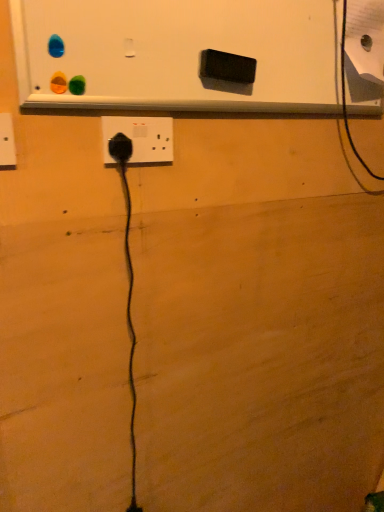
What do you see at coordinates (176, 54) in the screenshot? The height and width of the screenshot is (512, 384). I see `white matte bulletin board at upper center` at bounding box center [176, 54].

What do you see at coordinates (120, 148) in the screenshot? I see `black rubber power plug at center, the 3th power plugs and sockets positioned from the front` at bounding box center [120, 148].

The width and height of the screenshot is (384, 512). I want to click on white matte bulletin board at upper center, so click(176, 54).

Which is behind, point (168, 122) or point (8, 135)?

Point (168, 122)

The image size is (384, 512). What are the coordinates of `power plugs and sockets that appears in front of the black plastic power plug at center, the third power plugs and sockets from the left` in the screenshot? It's located at (x=7, y=143).

Considering the relative sizes of black plastic power plug at center, which is the 2th power plugs and sockets in front-to-back order, and black plastic power plug at left, the third power plugs and sockets from the right, in the image provided, is black plastic power plug at center, which is the 2th power plugs and sockets in front-to-back order, thinner than black plastic power plug at left, the third power plugs and sockets from the right,?

Yes, black plastic power plug at center, which is the 2th power plugs and sockets in front-to-back order, is thinner than black plastic power plug at left, the third power plugs and sockets from the right.

From the image's perspective, would you say black plastic power plug at center, which is the 2th power plugs and sockets in front-to-back order, is shown under black plastic power plug at left, the third power plugs and sockets from the back?

Incorrect, from the image's perspective, black plastic power plug at center, which is the 2th power plugs and sockets in front-to-back order, is higher than black plastic power plug at left, the third power plugs and sockets from the back.

Is black plastic power plug at left, the third power plugs and sockets from the back, positioned behind black rubber power plug at center, the 3th power plugs and sockets positioned from the front?

No, it is not.

Is black rubber power plug at center, the second power plugs and sockets from the right, at the back of black plastic power plug at left, the third power plugs and sockets from the back?

No, black plastic power plug at left, the third power plugs and sockets from the back,'s orientation is not away from black rubber power plug at center, the second power plugs and sockets from the right.

Measure the distance between black plastic power plug at left, the 1th power plugs and sockets positioned from the front, and black rubber power plug at center, placed as the first power plugs and sockets when sorted from back to front.

A distance of 7.27 inches exists between black plastic power plug at left, the 1th power plugs and sockets positioned from the front, and black rubber power plug at center, placed as the first power plugs and sockets when sorted from back to front.

Between black plastic power plug at center, which is the 2th power plugs and sockets in front-to-back order, and white matte bulletin board at upper center, which one is positioned in front?

white matte bulletin board at upper center is more forward.

From a real-world perspective, starting from the white matte bulletin board at upper center, which power plugs and sockets is the 2nd one below it? Please provide its 2D coordinates.

[(141, 138)]

Which of these two, black plastic power plug at center, the 1th power plugs and sockets in the right-to-left sequence, or white matte bulletin board at upper center, stands taller?

With more height is white matte bulletin board at upper center.

Can you confirm if black plastic power plug at center, the third power plugs and sockets from the left, is bigger than white matte bulletin board at upper center?

No.

Between black rubber power plug at center, marked as the 2th power plugs and sockets in a left-to-right arrangement, and white matte bulletin board at upper center, which one has smaller width?

Thinner between the two is black rubber power plug at center, marked as the 2th power plugs and sockets in a left-to-right arrangement.

Is black rubber power plug at center, marked as the 2th power plugs and sockets in a left-to-right arrangement, to the left or to the right of white matte bulletin board at upper center in the image?

black rubber power plug at center, marked as the 2th power plugs and sockets in a left-to-right arrangement, is positioned on white matte bulletin board at upper center's left side.

Considering the relative sizes of black rubber power plug at center, the 3th power plugs and sockets positioned from the front, and white matte bulletin board at upper center in the image provided, is black rubber power plug at center, the 3th power plugs and sockets positioned from the front, smaller than white matte bulletin board at upper center?

Correct, black rubber power plug at center, the 3th power plugs and sockets positioned from the front, occupies less space than white matte bulletin board at upper center.

What's the angular difference between black rubber power plug at center, marked as the 2th power plugs and sockets in a left-to-right arrangement, and white matte bulletin board at upper center's facing directions?

1.76 degrees.

Is white matte bulletin board at upper center outside of black plastic power plug at left, which is the 1th power plugs and sockets in left-to-right order?

Yes.

In the scene shown: Is white matte bulletin board at upper center wider than black plastic power plug at left, the third power plugs and sockets from the back?

Yes.

From a real-world perspective, is white matte bulletin board at upper center positioned under black plastic power plug at left, the third power plugs and sockets from the right, based on gravity?

Incorrect, from a real-world perspective, white matte bulletin board at upper center is higher than black plastic power plug at left, the third power plugs and sockets from the right.

Based on the photo, from the image's perspective, is white matte bulletin board at upper center located above or below black plastic power plug at left, the third power plugs and sockets from the right?

From the image's perspective, white matte bulletin board at upper center appears above black plastic power plug at left, the third power plugs and sockets from the right.

Which object is more forward, black plastic power plug at center, the 1th power plugs and sockets in the right-to-left sequence, or black rubber power plug at center, the second power plugs and sockets from the right?

black plastic power plug at center, the 1th power plugs and sockets in the right-to-left sequence, is in front.

Does black plastic power plug at center, marked as the 2th power plugs and sockets in a back-to-front arrangement, turn towards black rubber power plug at center, the second power plugs and sockets from the right?

Yes, black plastic power plug at center, marked as the 2th power plugs and sockets in a back-to-front arrangement, is aimed at black rubber power plug at center, the second power plugs and sockets from the right.

Consider the image. From the image's perspective, is black plastic power plug at center, marked as the 2th power plugs and sockets in a back-to-front arrangement, beneath black rubber power plug at center, marked as the 2th power plugs and sockets in a left-to-right arrangement?

No, from the image's perspective, black plastic power plug at center, marked as the 2th power plugs and sockets in a back-to-front arrangement, is not beneath black rubber power plug at center, marked as the 2th power plugs and sockets in a left-to-right arrangement.

Does point (174, 1) come closer to viewer compared to point (120, 148)?

Yes, point (174, 1) is in front of point (120, 148).

Considering the sizes of objects white matte bulletin board at upper center and black rubber power plug at center, the second power plugs and sockets from the right, in the image provided, who is smaller, white matte bulletin board at upper center or black rubber power plug at center, the second power plugs and sockets from the right,?

With smaller size is black rubber power plug at center, the second power plugs and sockets from the right.

Does white matte bulletin board at upper center have a lesser height compared to black rubber power plug at center, marked as the 2th power plugs and sockets in a left-to-right arrangement?

No.

This screenshot has height=512, width=384. Identify the location of power plugs and sockets that is above the black plastic power plug at center, the third power plugs and sockets from the left (from a real-world perspective). (7, 143).

Identify the location of power plugs and sockets that is the 1st object to the right of the black plastic power plug at left, the third power plugs and sockets from the right, starting at the anchor. This screenshot has height=512, width=384. (120, 148).

Estimate the real-world distances between objects in this image. Which object is closer to black plastic power plug at center, the 1th power plugs and sockets in the right-to-left sequence, black plastic power plug at left, the 1th power plugs and sockets positioned from the front, or black rubber power plug at center, placed as the first power plugs and sockets when sorted from back to front?

Among the two, black rubber power plug at center, placed as the first power plugs and sockets when sorted from back to front, is located nearer to black plastic power plug at center, the 1th power plugs and sockets in the right-to-left sequence.

Estimate the real-world distances between objects in this image. Which object is closer to black rubber power plug at center, marked as the 2th power plugs and sockets in a left-to-right arrangement, black plastic power plug at left, the third power plugs and sockets from the back, or black plastic power plug at center, marked as the 2th power plugs and sockets in a back-to-front arrangement?

black plastic power plug at center, marked as the 2th power plugs and sockets in a back-to-front arrangement, is closer to black rubber power plug at center, marked as the 2th power plugs and sockets in a left-to-right arrangement.

From the image, which object appears to be farther from white matte bulletin board at upper center, black plastic power plug at left, the 1th power plugs and sockets positioned from the front, or black plastic power plug at center, which is the 2th power plugs and sockets in front-to-back order?

Based on the image, black plastic power plug at left, the 1th power plugs and sockets positioned from the front, appears to be further to white matte bulletin board at upper center.

Estimate the real-world distances between objects in this image. Which object is further from black plastic power plug at left, which is the 1th power plugs and sockets in left-to-right order, white matte bulletin board at upper center or black rubber power plug at center, the 3th power plugs and sockets positioned from the front?

white matte bulletin board at upper center lies further to black plastic power plug at left, which is the 1th power plugs and sockets in left-to-right order, than the other object.

When comparing their distances from black plastic power plug at left, the third power plugs and sockets from the back, does black plastic power plug at center, the 1th power plugs and sockets in the right-to-left sequence, or black rubber power plug at center, the second power plugs and sockets from the right, seem closer?

black rubber power plug at center, the second power plugs and sockets from the right, lies closer to black plastic power plug at left, the third power plugs and sockets from the back, than the other object.

Considering their positions, is black rubber power plug at center, marked as the 2th power plugs and sockets in a left-to-right arrangement, positioned further to black plastic power plug at center, which is the 2th power plugs and sockets in front-to-back order, than white matte bulletin board at upper center?

Based on the image, white matte bulletin board at upper center appears to be further to black plastic power plug at center, which is the 2th power plugs and sockets in front-to-back order.

Based on their spatial positions, is black plastic power plug at center, the 1th power plugs and sockets in the right-to-left sequence, or black plastic power plug at left, the third power plugs and sockets from the back, closer to black rubber power plug at center, marked as the 2th power plugs and sockets in a left-to-right arrangement?

The object closer to black rubber power plug at center, marked as the 2th power plugs and sockets in a left-to-right arrangement, is black plastic power plug at center, the 1th power plugs and sockets in the right-to-left sequence.

Based on their spatial positions, is black plastic power plug at left, which is the 1th power plugs and sockets in left-to-right order, or white matte bulletin board at upper center closer to black plastic power plug at center, the third power plugs and sockets from the left?

Among the two, white matte bulletin board at upper center is located nearer to black plastic power plug at center, the third power plugs and sockets from the left.

At what (x,y) coordinates should I click in order to perform the action: click on power plugs and sockets located between black plastic power plug at left, the third power plugs and sockets from the back, and black plastic power plug at center, which is the 2th power plugs and sockets in front-to-back order, in the left-right direction. Please return your answer as a coordinate pair (x, y). The height and width of the screenshot is (512, 384). Looking at the image, I should click on (120, 148).

Where is `power plugs and sockets between white matte bulletin board at upper center and black rubber power plug at center, placed as the first power plugs and sockets when sorted from back to front, in the up-down direction`? This screenshot has height=512, width=384. power plugs and sockets between white matte bulletin board at upper center and black rubber power plug at center, placed as the first power plugs and sockets when sorted from back to front, in the up-down direction is located at coordinates coord(141,138).